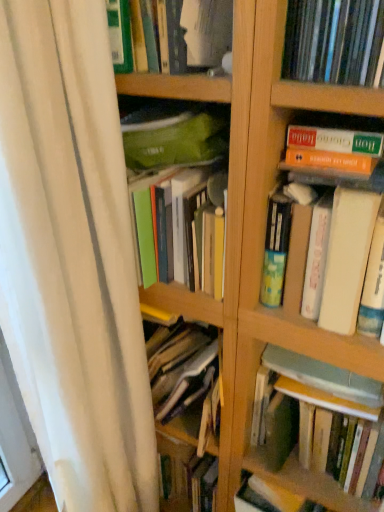
Question: Is hardcover book at center, arranged as the 4th book when viewed from the top, facing towards matte plastic books at upper right, the 2th book positioned from the top?

Choices:
 (A) yes
 (B) no

Answer: (B)

Question: Can you confirm if hardcover book at center, arranged as the 4th book when viewed from the top, is thinner than matte plastic books at upper right, the 3th book positioned from the bottom?

Choices:
 (A) no
 (B) yes

Answer: (B)

Question: Are hardcover book at center, arranged as the 4th book when viewed from the top, and matte plastic books at upper right, the 3th book positioned from the bottom, making contact?

Choices:
 (A) no
 (B) yes

Answer: (A)

Question: From a real-world perspective, is hardcover book at center, acting as the 1th book starting from the bottom, below matte plastic books at upper right, the 2th book positioned from the top?

Choices:
 (A) yes
 (B) no

Answer: (A)

Question: Is hardcover book at center, arranged as the 4th book when viewed from the top, surrounding matte plastic books at upper right, the 2th book positioned from the top?

Choices:
 (A) no
 (B) yes

Answer: (A)

Question: Is the position of hardcover book at center, acting as the 1th book starting from the bottom, more distant than that of matte plastic books at upper right, the 2th book positioned from the top?

Choices:
 (A) no
 (B) yes

Answer: (B)

Question: Is green matte book at upper center, marked as the 4th book in a bottom-to-top arrangement, turned away from hardcover book at upper right, the third book when ordered from top to bottom?

Choices:
 (A) no
 (B) yes

Answer: (A)

Question: Is green matte book at upper center, arranged as the first book when viewed from the top, at the right side of hardcover book at upper right, the third book when ordered from top to bottom?

Choices:
 (A) yes
 (B) no

Answer: (B)

Question: From the image's perspective, does green matte book at upper center, arranged as the first book when viewed from the top, appear lower than hardcover book at upper right, the third book when ordered from top to bottom?

Choices:
 (A) no
 (B) yes

Answer: (A)

Question: Is green matte book at upper center, arranged as the first book when viewed from the top, not within hardcover book at upper right, the third book when ordered from top to bottom?

Choices:
 (A) yes
 (B) no

Answer: (A)

Question: Does green matte book at upper center, marked as the 4th book in a bottom-to-top arrangement, have a lesser height compared to hardcover book at upper right, the second book when ordered from bottom to top?

Choices:
 (A) yes
 (B) no

Answer: (A)

Question: Is green matte book at upper center, marked as the 4th book in a bottom-to-top arrangement, further to the viewer compared to hardcover book at upper right, the second book when ordered from bottom to top?

Choices:
 (A) yes
 (B) no

Answer: (A)

Question: Is hardcover book at center, acting as the 1th book starting from the bottom, not near white fabric shower curtain at left?

Choices:
 (A) yes
 (B) no

Answer: (B)